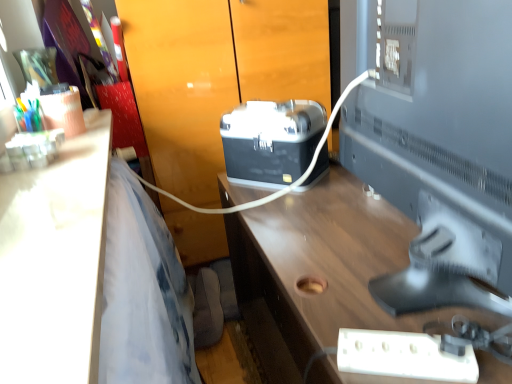
Where is `free space behind white plastic extension cord at lower right`? free space behind white plastic extension cord at lower right is located at coordinates (366, 301).